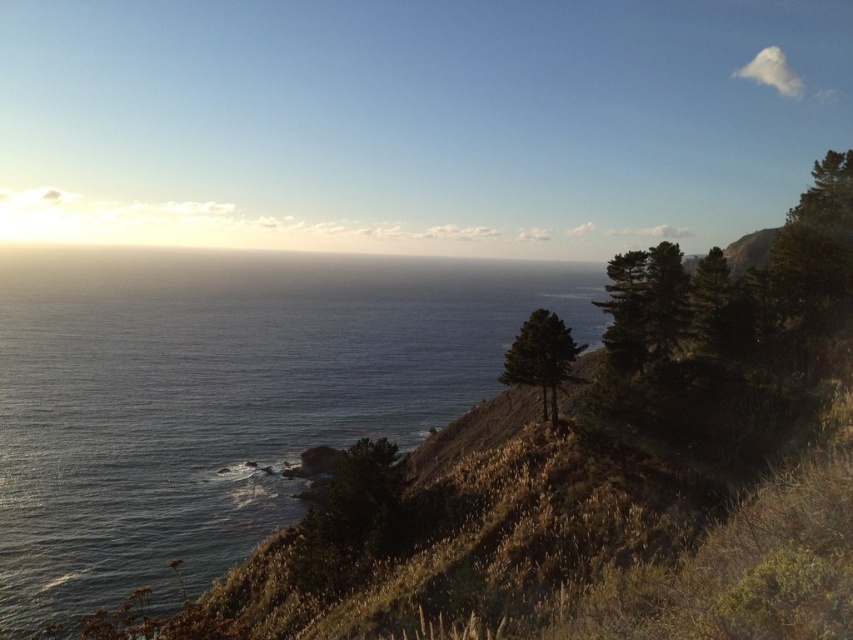
Question: Is blue water at center below green leafy tree at upper right?

Choices:
 (A) yes
 (B) no

Answer: (B)

Question: In this image, where is green leafy tree at upper right located relative to green leafy tree at center?

Choices:
 (A) left
 (B) right

Answer: (B)

Question: Which point is closer to the camera taking this photo?

Choices:
 (A) pyautogui.click(x=265, y=339)
 (B) pyautogui.click(x=567, y=332)

Answer: (B)

Question: Which point appears closest to the camera in this image?

Choices:
 (A) (450, 308)
 (B) (840, 260)
 (C) (531, 380)

Answer: (B)

Question: Is blue water at center smaller than green leafy tree at upper right?

Choices:
 (A) yes
 (B) no

Answer: (B)

Question: Based on their relative distances, which object is nearer to the green leafy tree at upper right?

Choices:
 (A) blue water at center
 (B) green leafy tree at center

Answer: (B)